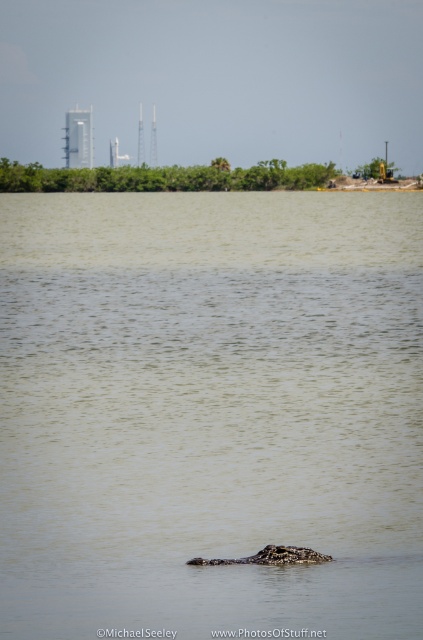
Question: Observing the image, what is the correct spatial positioning of brown textured water at center in reference to dark brown textured crocodile at center?

Choices:
 (A) above
 (B) below

Answer: (A)

Question: Does brown textured water at center have a larger size compared to dark brown textured crocodile at center?

Choices:
 (A) no
 (B) yes

Answer: (B)

Question: Which of the following is the closest to the observer?

Choices:
 (A) (285, 545)
 (B) (349, 632)

Answer: (B)

Question: Among these points, which one is nearest to the camera?

Choices:
 (A) (169, 620)
 (B) (206, 561)

Answer: (A)

Question: Does brown textured water at center have a smaller size compared to dark brown textured crocodile at center?

Choices:
 (A) yes
 (B) no

Answer: (B)